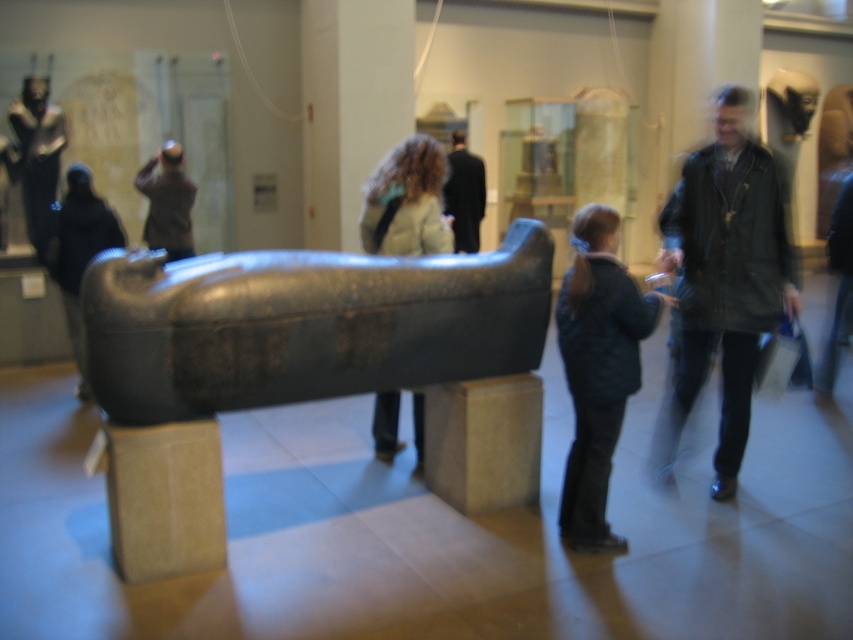
You are a museum security guard who needs to ensure that the polished dark gray stone sarcophagus at center is visible to visitors. Since the dark brown leather jacket at center is blocking its view, can you determine which object is taller so you can decide which one to move?

The polished dark gray stone sarcophagus at center is shorter than the dark brown leather jacket at center, so you should move the dark brown leather jacket at center to ensure the sarcophagus is visible.

You are a security guard in the museum and need to ensure that the dark brown leather jacket at right and the dark brown leather jacket at center are displayed properly. Which jacket has a greater width?

The dark brown leather jacket at right has a greater width than the dark brown leather jacket at center.